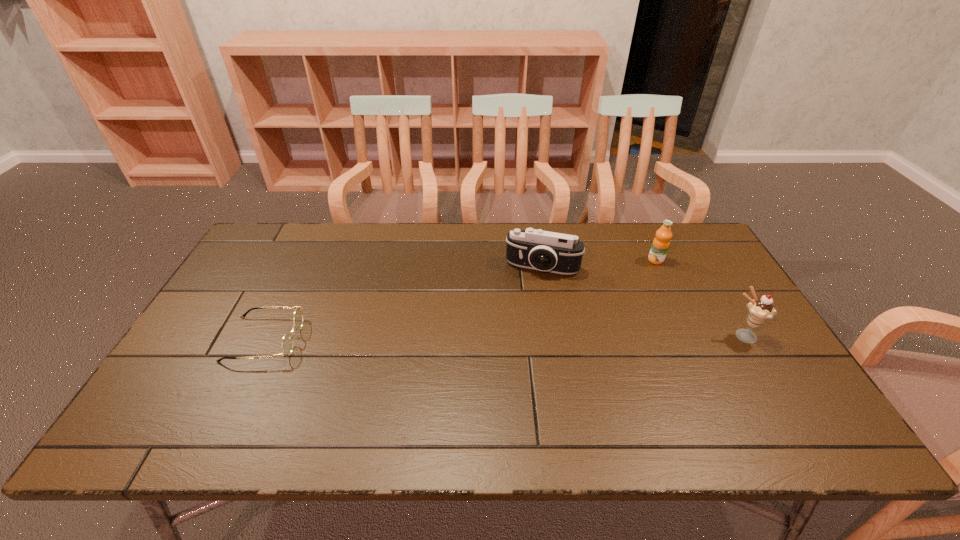
What are the coordinates of `free region at the right edge of the desktop` in the screenshot? It's located at (701, 307).

In the image, there is a desktop. Where is `vacant space at the far left corner`? The height and width of the screenshot is (540, 960). vacant space at the far left corner is located at coordinates (253, 255).

This screenshot has height=540, width=960. What are the coordinates of `free space at the far right corner` in the screenshot? It's located at (672, 225).

This screenshot has width=960, height=540. In the image, there is a desktop. What are the coordinates of `free space at the near right corner` in the screenshot? It's located at (770, 401).

Where is `unoccupied position between the rightmost object and the camera`? unoccupied position between the rightmost object and the camera is located at coordinates (642, 302).

In order to click on vacant space in between the leftmost object and the camera in this screenshot , I will do `click(403, 303)`.

At what (x,y) coordinates should I click in order to perform the action: click on vacant area between the camera and the spectacles. Please return your answer as a coordinate pair (x, y). This screenshot has height=540, width=960. Looking at the image, I should click on (403, 303).

Locate an element on the screen. This screenshot has height=540, width=960. empty space that is in between the rightmost object and the spectacles is located at coordinates (503, 338).

Where is `free space between the orange juice and the camera`? Image resolution: width=960 pixels, height=540 pixels. free space between the orange juice and the camera is located at coordinates (599, 264).

You are a GUI agent. You are given a task and a screenshot of the screen. Output one action in this format:
    pyautogui.click(x=<x>, y=<y>)
    Task: Click on the vacant area between the camera and the second object from right to left
    
    Given the screenshot: What is the action you would take?
    pyautogui.click(x=599, y=264)